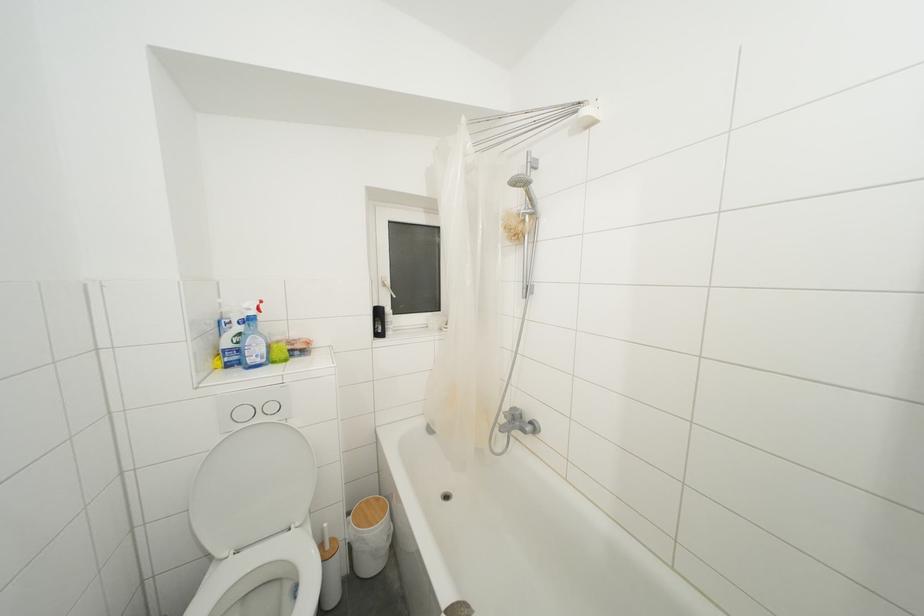
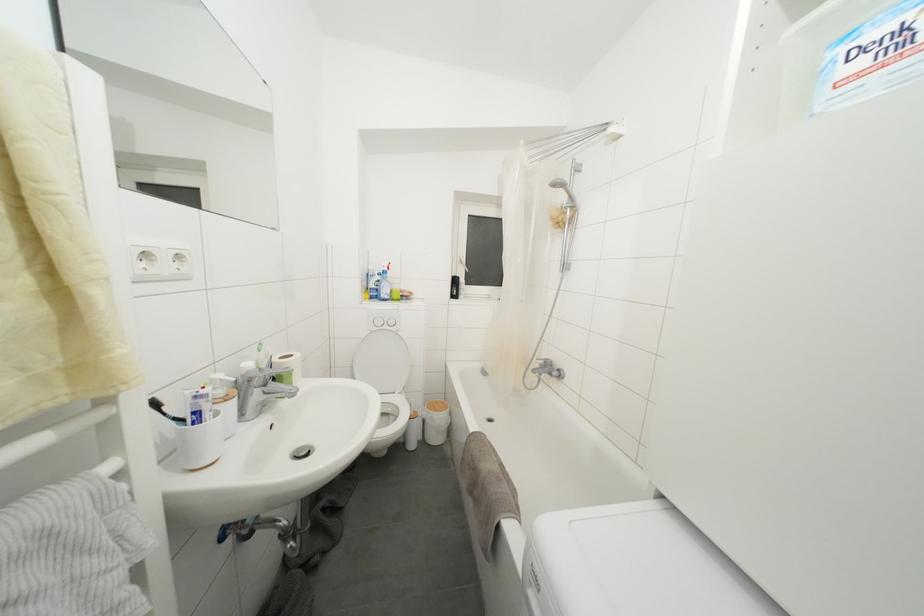
What movement of the cameraman would produce the second image?

The movement direction of the cameraman is right, backward.